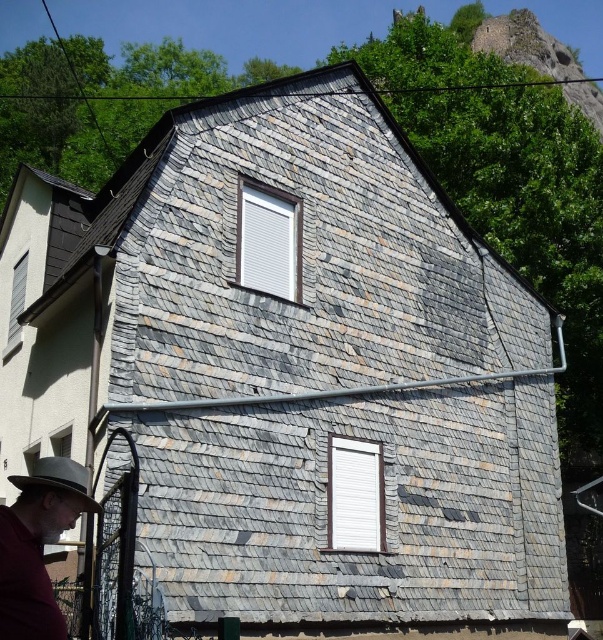
Is point (46, 541) positioned after point (40, 477)?

Yes, point (46, 541) is behind point (40, 477).

Does point (89, 512) come closer to viewer compared to point (10, 476)?

Yes, point (89, 512) is in front of point (10, 476).

Is point (63, 481) positioned before point (92, 506)?

Yes, it is in front of point (92, 506).

Locate an element on the screen. gray felt hat at lower left is located at coordinates (37, 545).